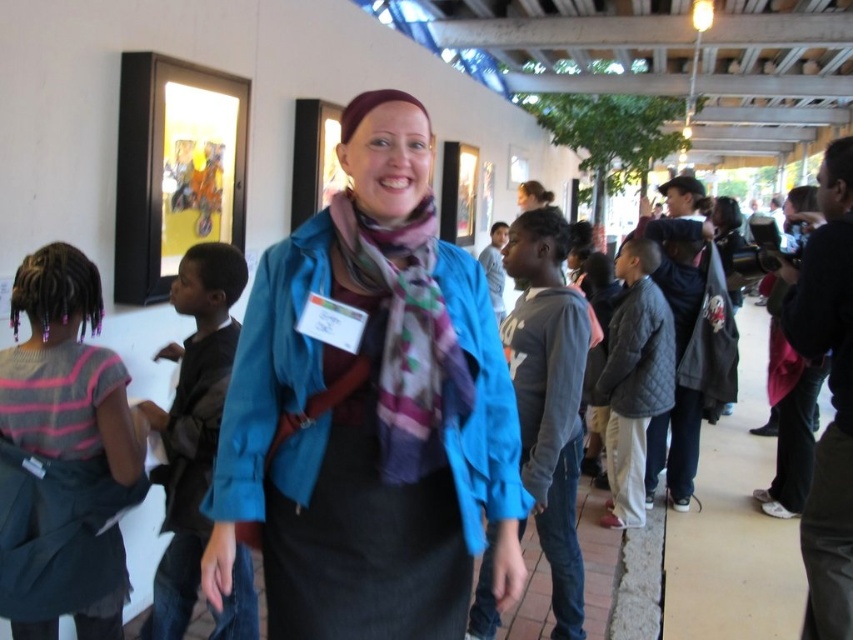
Question: Is dark blue shirt at center to the left of multicolored woven scarf at center from the viewer's perspective?

Choices:
 (A) no
 (B) yes

Answer: (B)

Question: Can you confirm if striped cotton shirt at left is positioned below gray fleece hoodie at center?

Choices:
 (A) no
 (B) yes

Answer: (A)

Question: Among these objects, which one is nearest to the camera?

Choices:
 (A) gray fleece hoodie at center
 (B) multicolored woven scarf at center
 (C) striped cotton shirt at left

Answer: (B)

Question: Among these objects, which one is nearest to the camera?

Choices:
 (A) blue fabric jacket at center
 (B) striped cotton shirt at left

Answer: (A)

Question: Among these objects, which one is nearest to the camera?

Choices:
 (A) multicolored woven scarf at center
 (B) blue fabric jacket at center
 (C) striped cotton shirt at left
 (D) gray fleece hoodie at center

Answer: (A)

Question: Can you confirm if blue fabric jacket at center is thinner than gray fleece hoodie at center?

Choices:
 (A) yes
 (B) no

Answer: (B)